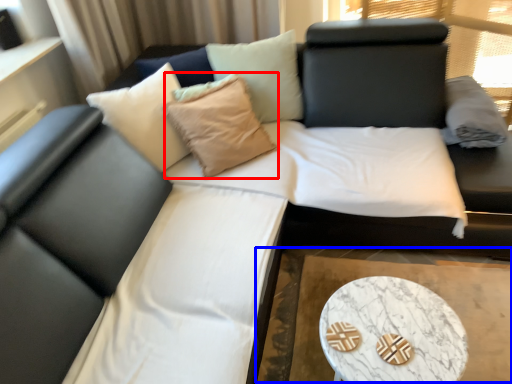
Question: Which of the following is the farthest to the observer, throw pillow (highlighted by a red box) or cocktail table (highlighted by a blue box)?

Choices:
 (A) throw pillow
 (B) cocktail table

Answer: (A)